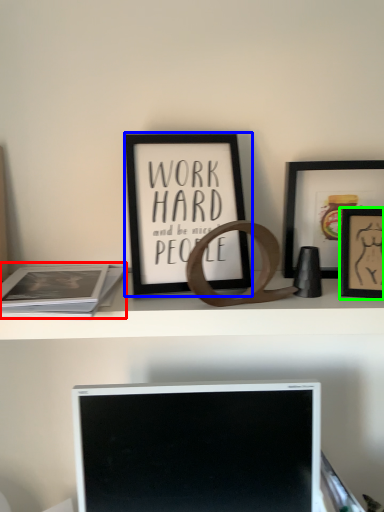
Question: Which object is positioned closest to paperback book (highlighted by a red box)? Select from picture frame (highlighted by a blue box) and picture frame (highlighted by a green box).

Choices:
 (A) picture frame
 (B) picture frame

Answer: (A)